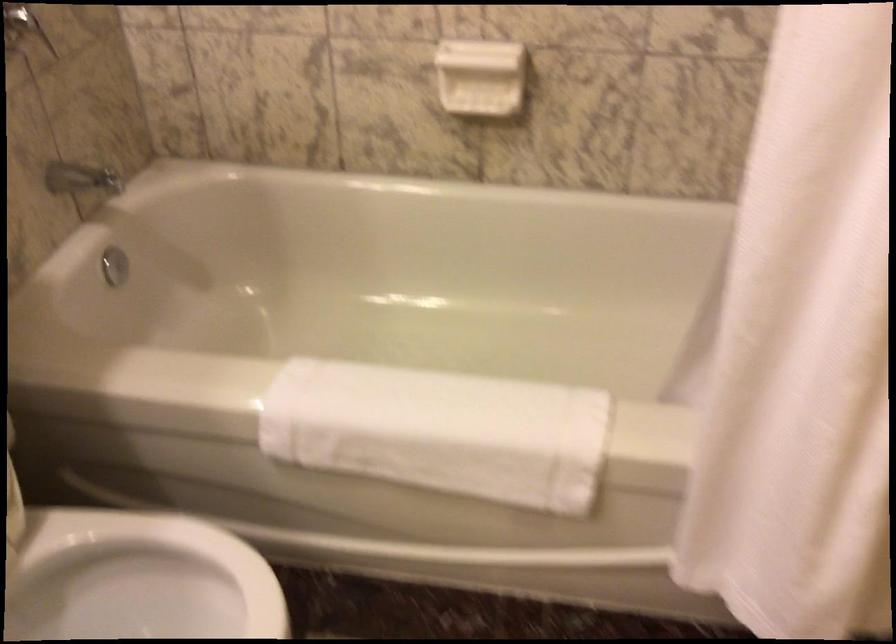
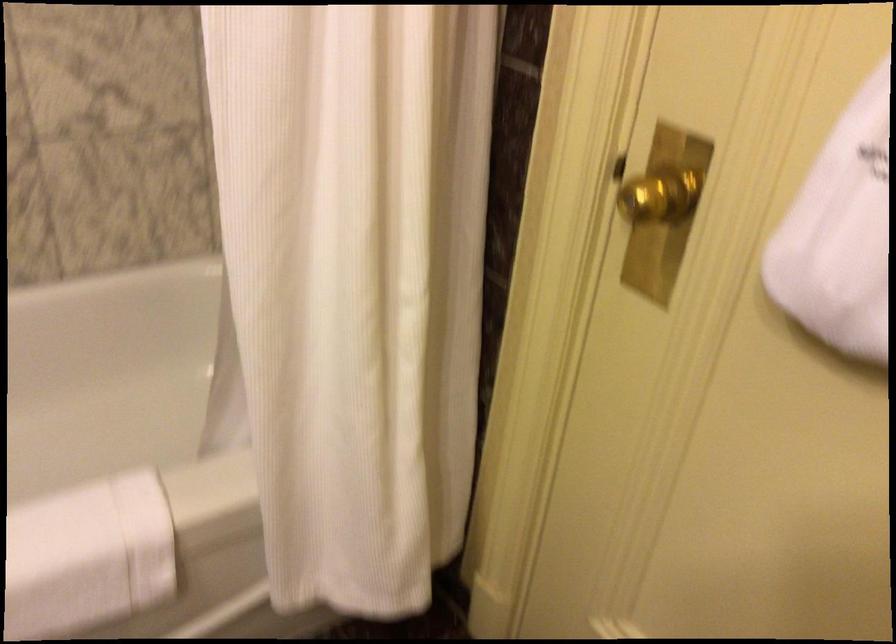
Question: How did the camera likely rotate?

Choices:
 (A) Left
 (B) Right
 (C) Up
 (D) Down

Answer: (B)